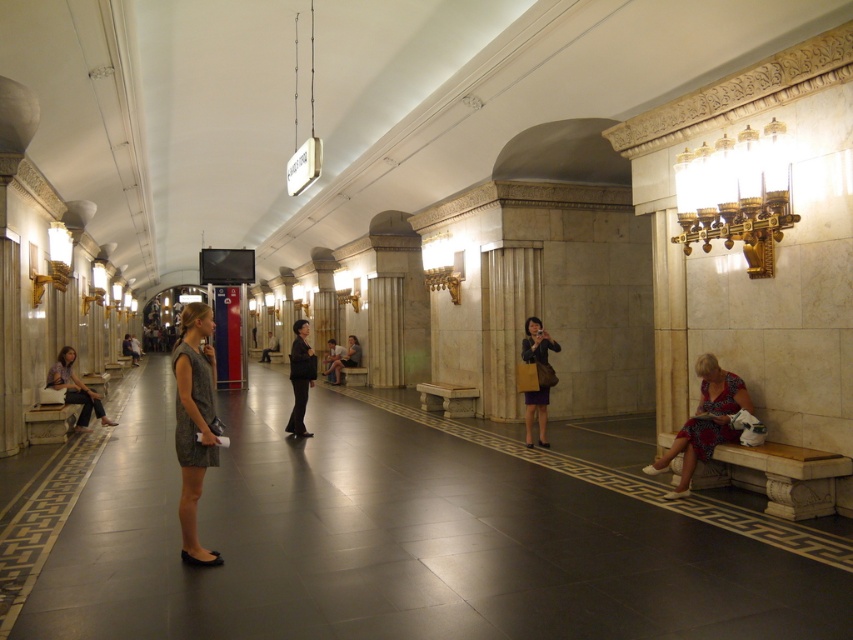
Question: Is printed fabric dress at right wider than matte purple dress at left?

Choices:
 (A) yes
 (B) no

Answer: (B)

Question: Can you confirm if printed fabric dress at right is positioned above black leather jacket at center?

Choices:
 (A) no
 (B) yes

Answer: (A)

Question: Which of these objects is positioned farthest from the printed fabric dress at right?

Choices:
 (A) black leather jacket at center
 (B) matte purple dress at left
 (C) matte brown coat at center

Answer: (B)

Question: Can you confirm if printed fabric dress at right is wider than black leather jacket at center?

Choices:
 (A) no
 (B) yes

Answer: (B)

Question: Which is nearer to the black leather jacket at center?

Choices:
 (A) gray textured dress at center
 (B) printed fabric dress at right
 (C) marble bench at lower right

Answer: (A)

Question: Among these points, which one is farthest from the camera?

Choices:
 (A) (51, 376)
 (B) (686, 492)
 (C) (192, 445)
 (D) (848, 513)

Answer: (A)